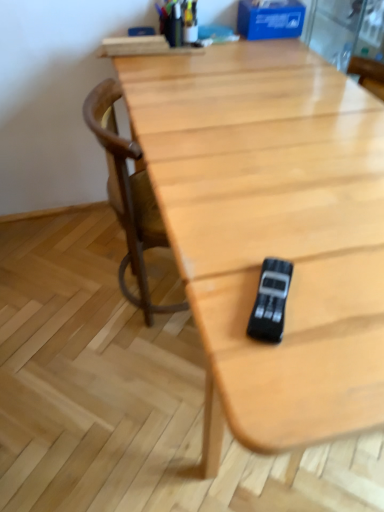
Question: From the image's perspective, is black plastic game controller at center located above or below wooden chair at center?

Choices:
 (A) above
 (B) below

Answer: (B)

Question: Considering the positions of black plastic game controller at center and wooden chair at center in the image, is black plastic game controller at center wider or thinner than wooden chair at center?

Choices:
 (A) wide
 (B) thin

Answer: (B)

Question: Considering the positions of point (268, 291) and point (135, 227), is point (268, 291) closer or farther from the camera than point (135, 227)?

Choices:
 (A) closer
 (B) farther

Answer: (A)

Question: Is wooden chair at center to the left or to the right of black plastic game controller at center in the image?

Choices:
 (A) right
 (B) left

Answer: (B)

Question: Considering the positions of wooden chair at center and black plastic game controller at center in the image, is wooden chair at center bigger or smaller than black plastic game controller at center?

Choices:
 (A) small
 (B) big

Answer: (B)

Question: Relative to black plastic game controller at center, is wooden chair at center in front or behind?

Choices:
 (A) behind
 (B) front

Answer: (A)

Question: Which is correct: wooden chair at center is inside black plastic game controller at center, or outside of it?

Choices:
 (A) inside
 (B) outside

Answer: (B)